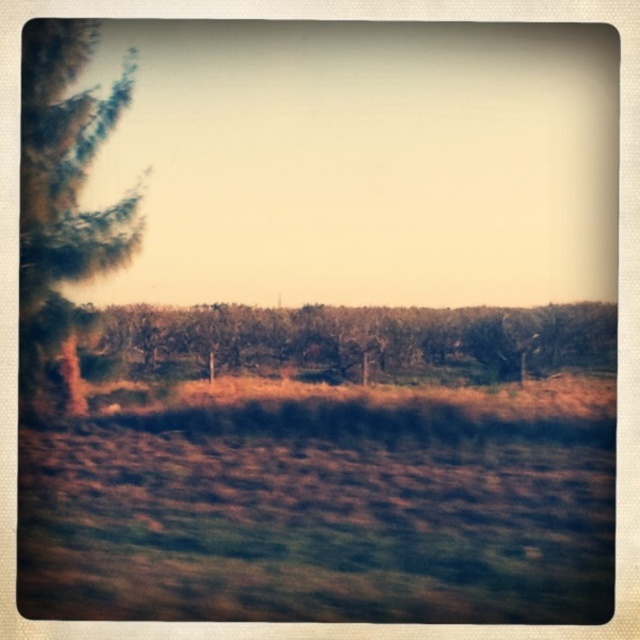
You are standing at the center of the field in the image. Which direction should you walk to reach the brown grass at lower center?

You should walk towards the lower center direction to reach the brown grass at lower center, as it is located at point coordinates of [324,506].

You are a gardener who wants to plant a new tree in the field. The recommended spacing between plants is 12 inches. Based on the distance between the brown grass at lower center and the brown textured trees at center, is this area suitable for planting a new tree?

The brown grass at lower center and brown textured trees at center are 10.86 inches apart, which is less than the recommended 12 inches spacing. Therefore, this area is not suitable for planting a new tree.

You are a farmer checking the field conditions. You notice the brown grass at lower center and the brown textured trees at center. Which area would you prioritize for irrigation based on their spatial relationship?

The brown grass at lower center might be wider than brown textured trees at center, so the grass area requires more immediate attention as it covers a larger area and may need water more urgently.